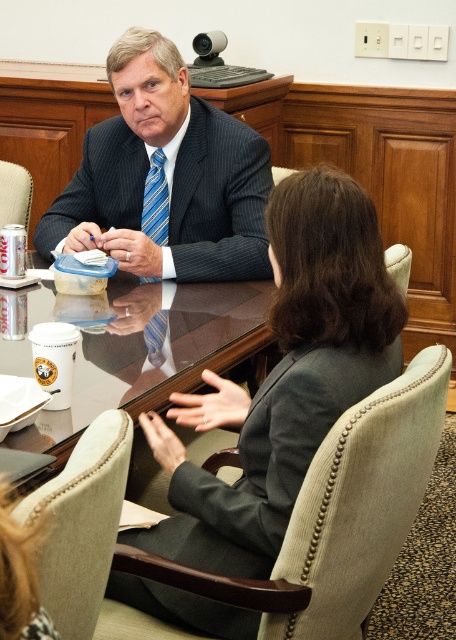
You are a furniture designer observing the conference room scene. You need to determine if the glossy wood round table at center can be placed under the dark blue pinstripe suit at center without any issues. Can it fit?

The glossy wood round table at center is not as tall as the dark blue pinstripe suit at center, so it can fit under it without any issues.

You are attending a meeting in this conference room and need to sit next to the person wearing the dark blue pinstripe suit at center. Where should you sit relative to the dark gray fabric business suit at center?

You should sit to the left of the dark gray fabric business suit at center because the dark blue pinstripe suit at center is to the left of the dark gray fabric business suit at center.